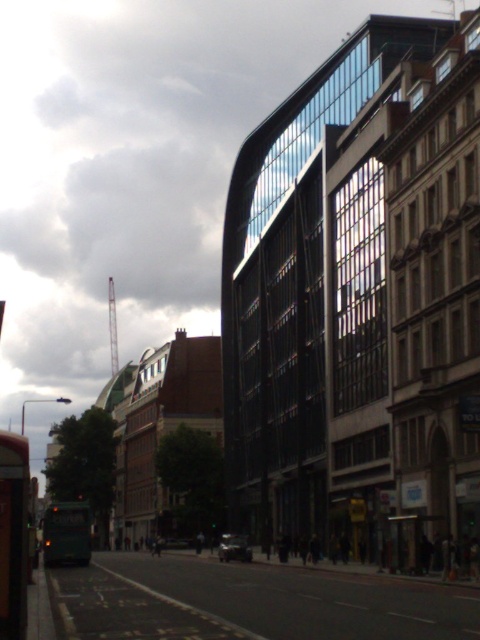
Question: Does black asphalt road at center have a smaller size compared to green matte bus at lower left?

Choices:
 (A) no
 (B) yes

Answer: (A)

Question: Where is black asphalt road at center located in relation to green matte bus at lower left in the image?

Choices:
 (A) left
 (B) right

Answer: (B)

Question: Does black asphalt road at center appear on the right side of green matte bus at lower left?

Choices:
 (A) no
 (B) yes

Answer: (B)

Question: Which point is closer to the camera?

Choices:
 (A) (63, 516)
 (B) (146, 568)

Answer: (A)